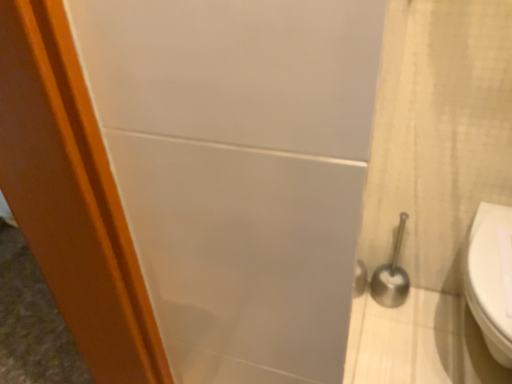
The image size is (512, 384). Describe the element at coordinates (391, 275) in the screenshot. I see `satin silver toilet brush at right` at that location.

Where is `satin silver toilet brush at right`? Image resolution: width=512 pixels, height=384 pixels. satin silver toilet brush at right is located at coordinates tap(391, 275).

At what (x,y) coordinates should I click in order to perform the action: click on white glossy toilet at right. Please return your answer as a coordinate pair (x, y). This screenshot has width=512, height=384. Looking at the image, I should click on (490, 277).

This screenshot has height=384, width=512. Describe the element at coordinates (490, 277) in the screenshot. I see `white glossy toilet at right` at that location.

In order to face white glossy toilet at right, should I rotate leftwards or rightwards?

To face it directly, rotate right by 29.155 degrees.

At what (x,y) coordinates should I click in order to perform the action: click on satin silver toilet brush at right. Please return your answer as a coordinate pair (x, y). The width and height of the screenshot is (512, 384). Looking at the image, I should click on (391, 275).

Is white glossy toilet at right at the right side of satin silver toilet brush at right?

Indeed, white glossy toilet at right is positioned on the right side of satin silver toilet brush at right.

Is white glossy toilet at right further to camera compared to satin silver toilet brush at right?

That is False.

Considering the positions of point (487, 209) and point (390, 263), is point (487, 209) closer or farther from the camera than point (390, 263)?

Point (487, 209) is closer to the camera than point (390, 263).

From the image's perspective, between white glossy toilet at right and satin silver toilet brush at right, which one is located above?

satin silver toilet brush at right.

In the scene shown: From a real-world perspective, between white glossy toilet at right and satin silver toilet brush at right, who is vertically lower?

From a 3D spatial view, satin silver toilet brush at right is below.

Between white glossy toilet at right and satin silver toilet brush at right, which one has smaller width?

satin silver toilet brush at right is thinner.

From their relative heights in the image, would you say white glossy toilet at right is taller or shorter than satin silver toilet brush at right?

Considering their sizes, white glossy toilet at right has less height than satin silver toilet brush at right.

Between white glossy toilet at right and satin silver toilet brush at right, which one has smaller size?

With smaller size is satin silver toilet brush at right.

Would you say white glossy toilet at right is outside satin silver toilet brush at right?

Indeed, white glossy toilet at right is completely outside satin silver toilet brush at right.

Is white glossy toilet at right far from satin silver toilet brush at right?

No, white glossy toilet at right is not far from satin silver toilet brush at right.

Does white glossy toilet at right turn towards satin silver toilet brush at right?

No, white glossy toilet at right does not turn towards satin silver toilet brush at right.

At what (x,y) coordinates should I click in order to perform the action: click on shower that appears on the left of white glossy toilet at right. Please return your answer as a coordinate pair (x, y). This screenshot has height=384, width=512. Looking at the image, I should click on (391, 275).

Which is more to the right, satin silver toilet brush at right or white glossy toilet at right?

white glossy toilet at right.

Is satin silver toilet brush at right in front of or behind white glossy toilet at right in the image?

satin silver toilet brush at right is positioned farther from the viewer than white glossy toilet at right.

Does point (400, 281) lie behind point (511, 225)?

Yes, point (400, 281) is behind point (511, 225).

From the image's perspective, is satin silver toilet brush at right over white glossy toilet at right?

Indeed, from the image's perspective, satin silver toilet brush at right is shown above white glossy toilet at right.

From a real-world perspective, is satin silver toilet brush at right under white glossy toilet at right?

Indeed, from a real-world perspective, satin silver toilet brush at right is positioned beneath white glossy toilet at right.

Which of these two, satin silver toilet brush at right or white glossy toilet at right, is wider?

Wider between the two is white glossy toilet at right.

Consider the image. Can you confirm if satin silver toilet brush at right is shorter than white glossy toilet at right?

Incorrect, the height of satin silver toilet brush at right does not fall short of that of white glossy toilet at right.

Does satin silver toilet brush at right have a larger size compared to white glossy toilet at right?

Incorrect, satin silver toilet brush at right is not larger than white glossy toilet at right.

Can we say satin silver toilet brush at right lies outside white glossy toilet at right?

That's correct, satin silver toilet brush at right is outside of white glossy toilet at right.

Is there a large distance between satin silver toilet brush at right and white glossy toilet at right?

No, there isn't a large distance between satin silver toilet brush at right and white glossy toilet at right.

Could you tell me if satin silver toilet brush at right is facing white glossy toilet at right?

No, satin silver toilet brush at right is not turned towards white glossy toilet at right.

The width and height of the screenshot is (512, 384). In the image, there is a white glossy toilet at right. What are the coordinates of `shower above it (from the image's perspective)` in the screenshot? It's located at (391, 275).

Find the location of a particular element. The width and height of the screenshot is (512, 384). toilet lying in front of the satin silver toilet brush at right is located at coordinates (490, 277).

Where is `shower behind the white glossy toilet at right`? Image resolution: width=512 pixels, height=384 pixels. shower behind the white glossy toilet at right is located at coordinates (391, 275).